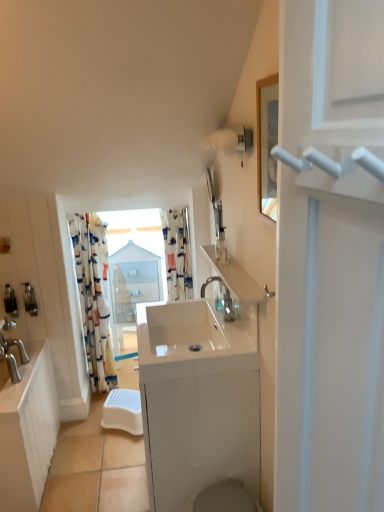
Question: Considering the relative positions of printed fabric curtain at center, which appears as the second curtain when viewed from the left, and white glossy sink at left, which is counted as the 1th counter top, starting from the left, in the image provided, is printed fabric curtain at center, which appears as the second curtain when viewed from the left, to the right of white glossy sink at left, which is counted as the 1th counter top, starting from the left, from the viewer's perspective?

Choices:
 (A) yes
 (B) no

Answer: (A)

Question: From a real-world perspective, is printed fabric curtain at center, which appears as the second curtain when viewed from the left, located beneath white glossy sink at left, which is counted as the 1th counter top, starting from the left?

Choices:
 (A) no
 (B) yes

Answer: (A)

Question: From a real-world perspective, is printed fabric curtain at center, the first curtain when ordered from right to left, over white glossy sink at left, which ranks as the second counter top in right-to-left order?

Choices:
 (A) yes
 (B) no

Answer: (A)

Question: Does printed fabric curtain at center, which appears as the second curtain when viewed from the left, have a greater height compared to white glossy sink at left, which is counted as the 1th counter top, starting from the left?

Choices:
 (A) yes
 (B) no

Answer: (A)

Question: Considering the relative sizes of printed fabric curtain at center, the first curtain when ordered from right to left, and white glossy sink at left, which is counted as the 1th counter top, starting from the left, in the image provided, is printed fabric curtain at center, the first curtain when ordered from right to left, bigger than white glossy sink at left, which is counted as the 1th counter top, starting from the left,?

Choices:
 (A) yes
 (B) no

Answer: (B)

Question: Does printed fabric curtain at center, which appears as the second curtain when viewed from the left, appear on the left side of white glossy sink at left, which ranks as the second counter top in right-to-left order?

Choices:
 (A) yes
 (B) no

Answer: (B)

Question: From the image's perspective, is white glossy sink at center located beneath translucent plastic soap dispenser at left, which is the 2th toiletry in left-to-right order?

Choices:
 (A) no
 (B) yes

Answer: (B)

Question: Does white glossy sink at center have a lesser height compared to translucent plastic soap dispenser at left, marked as the 1th toiletry in a back-to-front arrangement?

Choices:
 (A) yes
 (B) no

Answer: (A)

Question: Is white glossy sink at center bigger than translucent plastic soap dispenser at left, which is the 2th toiletry in left-to-right order?

Choices:
 (A) yes
 (B) no

Answer: (A)

Question: Does white glossy sink at center lie in front of translucent plastic soap dispenser at left, acting as the second toiletry starting from the bottom?

Choices:
 (A) no
 (B) yes

Answer: (B)

Question: Is white glossy sink at center directly adjacent to translucent plastic soap dispenser at left, which is the 2th toiletry in left-to-right order?

Choices:
 (A) yes
 (B) no

Answer: (B)

Question: From a real-world perspective, is white glossy sink at center physically above translucent plastic soap dispenser at left, acting as the second toiletry starting from the bottom?

Choices:
 (A) yes
 (B) no

Answer: (B)

Question: From the image's perspective, is metallic silver soap dispenser at left, the 1th toiletry positioned from the bottom, on printed fabric curtain at center, the first curtain when ordered from right to left?

Choices:
 (A) yes
 (B) no

Answer: (B)